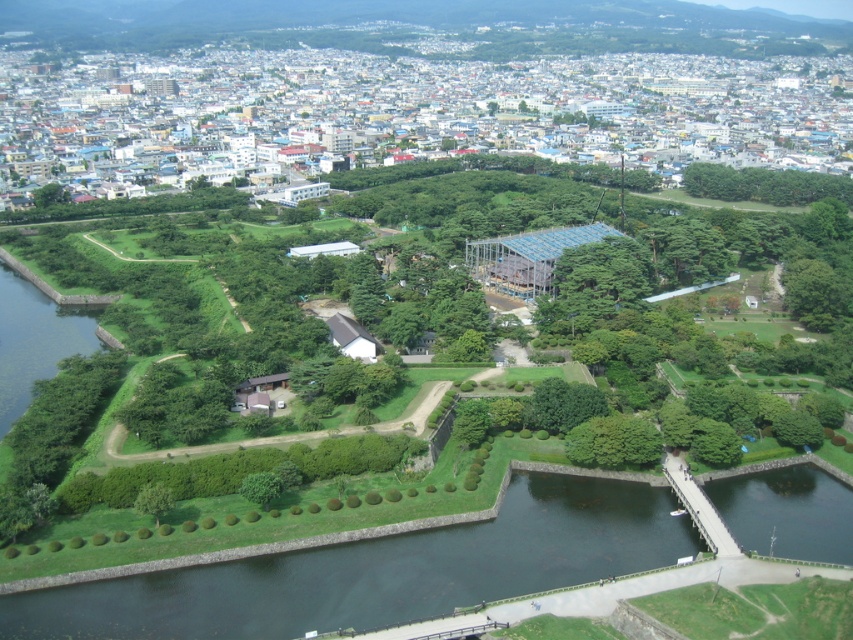
Question: Which point is farther to the camera?

Choices:
 (A) green leafy tree at center
 (B) green grassy river at lower center

Answer: (A)

Question: Observing the image, what is the correct spatial positioning of green grassy river at lower center in reference to green leafy tree at center?

Choices:
 (A) right
 (B) left

Answer: (B)

Question: Is green grassy river at lower center above green leafy tree at center?

Choices:
 (A) yes
 (B) no

Answer: (B)

Question: Is green grassy river at lower center below green leafy tree at center?

Choices:
 (A) no
 (B) yes

Answer: (B)

Question: Which object appears closest to the camera in this image?

Choices:
 (A) green grassy river at lower center
 (B) green leafy tree at center

Answer: (A)